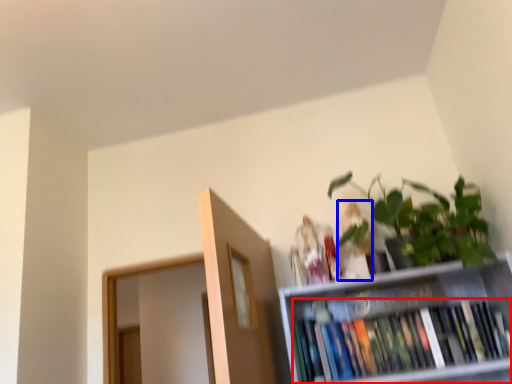
Question: Among these objects, which one is nearest to the camera, book (highlighted by a red box) or toy (highlighted by a blue box)?

Choices:
 (A) book
 (B) toy

Answer: (A)